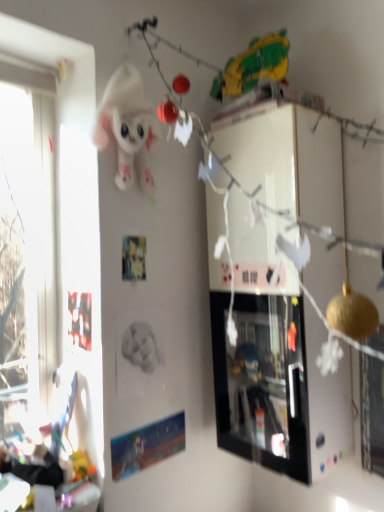
Question: Should I look upward or downward to see white plush toy at upper center?

Choices:
 (A) up
 (B) down

Answer: (A)

Question: Considering the relative sizes of white plush toy at upper center and black glossy picture frame at upper center in the image provided, is white plush toy at upper center thinner than black glossy picture frame at upper center?

Choices:
 (A) yes
 (B) no

Answer: (A)

Question: Does white plush toy at upper center have a greater width compared to black glossy picture frame at upper center?

Choices:
 (A) no
 (B) yes

Answer: (A)

Question: Is the position of white plush toy at upper center less distant than that of black glossy picture frame at upper center?

Choices:
 (A) yes
 (B) no

Answer: (A)

Question: From a real-world perspective, is white plush toy at upper center beneath black glossy picture frame at upper center?

Choices:
 (A) no
 (B) yes

Answer: (A)

Question: Does white plush toy at upper center have a smaller size compared to black glossy picture frame at upper center?

Choices:
 (A) yes
 (B) no

Answer: (A)

Question: Is white plush toy at upper center taller than black glossy picture frame at upper center?

Choices:
 (A) yes
 (B) no

Answer: (B)

Question: Does black glossy picture frame at upper center appear on the right side of white plush toy at upper center?

Choices:
 (A) no
 (B) yes

Answer: (B)

Question: From a real-world perspective, is black glossy picture frame at upper center beneath white plush toy at upper center?

Choices:
 (A) yes
 (B) no

Answer: (A)

Question: Is black glossy picture frame at upper center oriented away from white plush toy at upper center?

Choices:
 (A) no
 (B) yes

Answer: (A)

Question: From a real-world perspective, is black glossy picture frame at upper center located higher than white plush toy at upper center?

Choices:
 (A) yes
 (B) no

Answer: (B)

Question: Considering the relative positions of black glossy picture frame at upper center and white plush toy at upper center in the image provided, is black glossy picture frame at upper center to the left of white plush toy at upper center from the viewer's perspective?

Choices:
 (A) no
 (B) yes

Answer: (A)

Question: Does black glossy picture frame at upper center have a lesser height compared to white plush toy at upper center?

Choices:
 (A) no
 (B) yes

Answer: (A)

Question: Is point (122, 145) positioned closer to the camera than point (271, 300)?

Choices:
 (A) farther
 (B) closer

Answer: (B)